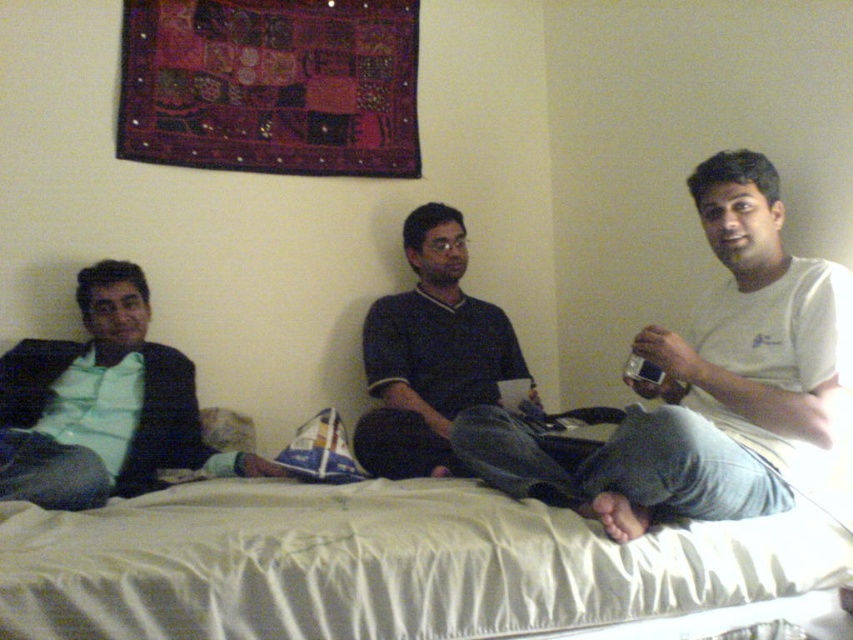
Question: Which is farther from the white cotton shirt at center?

Choices:
 (A) green matte shirt at left
 (B) dark blue jersey at center

Answer: (A)

Question: Which point is closer to the camera?

Choices:
 (A) (821, 433)
 (B) (416, 371)

Answer: (A)

Question: Is white cotton shirt at center further to camera compared to green matte shirt at left?

Choices:
 (A) yes
 (B) no

Answer: (B)

Question: Is white cotton shirt at center behind green matte shirt at left?

Choices:
 (A) no
 (B) yes

Answer: (A)

Question: Which point is closer to the camera?

Choices:
 (A) (712, 477)
 (B) (171, 442)
 (C) (514, 364)

Answer: (A)

Question: Considering the relative positions of green matte shirt at left and dark blue jersey at center in the image provided, where is green matte shirt at left located with respect to dark blue jersey at center?

Choices:
 (A) above
 (B) below

Answer: (B)